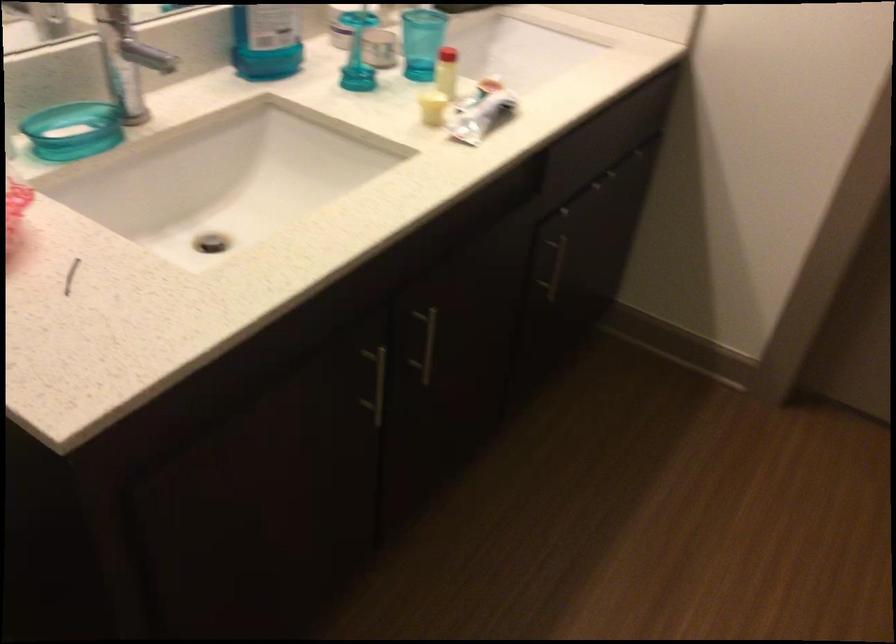
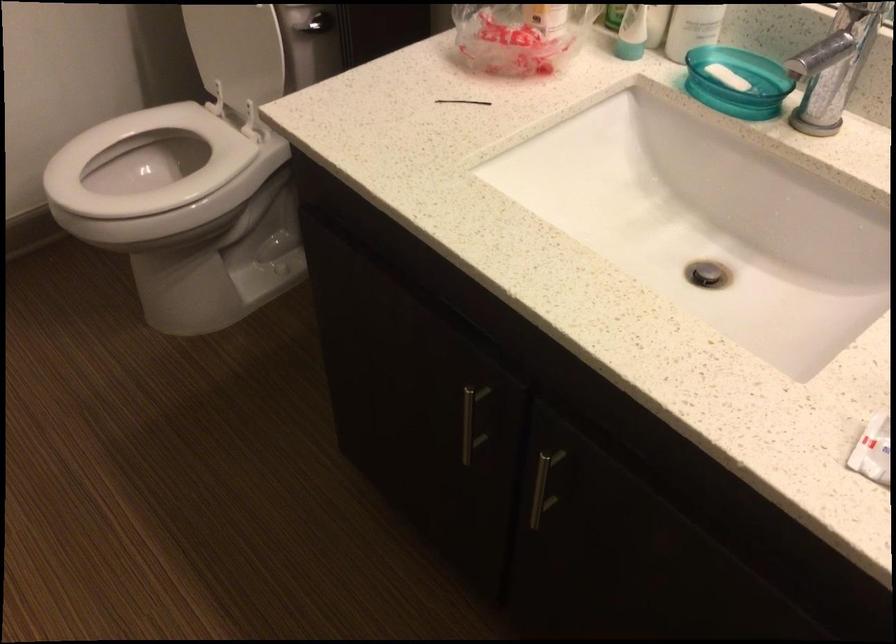
In the second image, find the point that corresponds to point (110, 84) in the first image.

(830, 75)